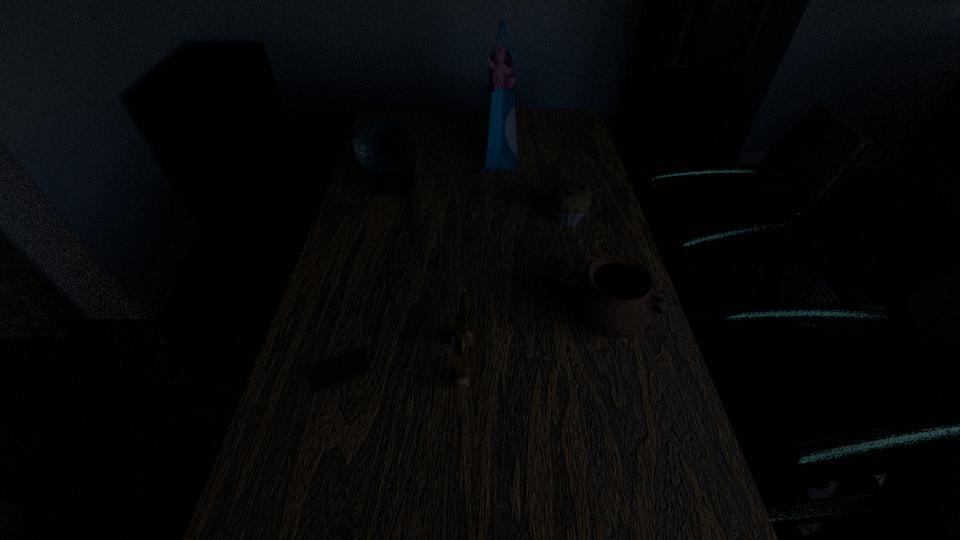
Image resolution: width=960 pixels, height=540 pixels. I want to click on free space at the right edge of the desktop, so coord(582,170).

What are the coordinates of `vacant space at the far left corner of the desktop` in the screenshot? It's located at coord(406,129).

At what (x,y) coordinates should I click in order to perform the action: click on vacant space at the far right corner of the desktop. Please return your answer as a coordinate pair (x, y). Looking at the image, I should click on (550, 111).

Image resolution: width=960 pixels, height=540 pixels. What are the coordinates of `blank region between the fourth tallest object and the earphone` in the screenshot? It's located at (532, 343).

Find the location of a particular element. free space between the muffin and the third object from left to right is located at coordinates click(x=515, y=292).

In order to click on unoccupied area between the second shortest object and the shopping bag in this screenshot , I will do `click(533, 184)`.

At what (x,y) coordinates should I click in order to perform the action: click on free point between the fourth object from right to left and the fourth tallest object. Please return your answer as a coordinate pair (x, y). This screenshot has width=960, height=540. Looking at the image, I should click on (532, 343).

Find the location of a particular element. The height and width of the screenshot is (540, 960). object that stands as the second closest to the shortest object is located at coordinates (614, 297).

Locate an element on the screen. object that ranks as the second closest to the shortest object is located at coordinates (614, 297).